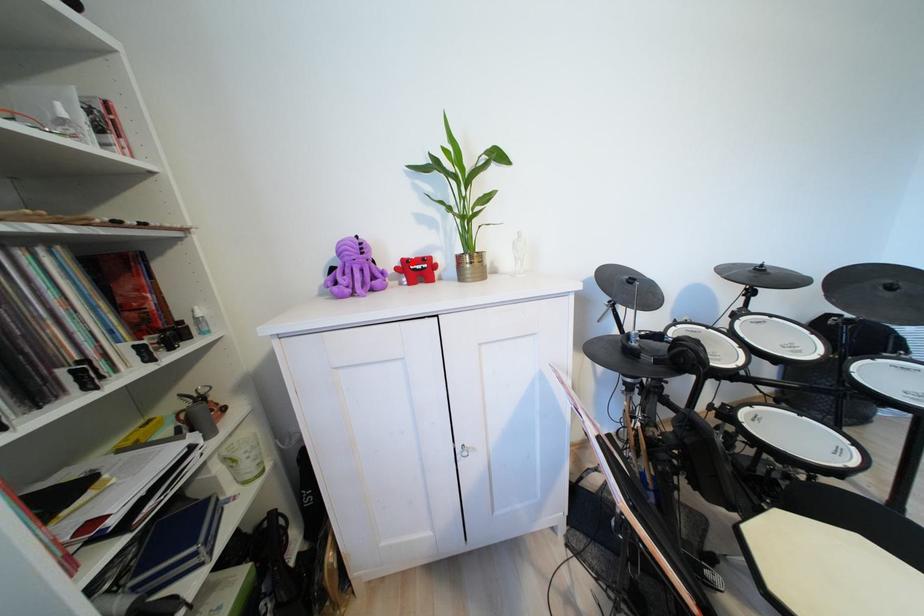
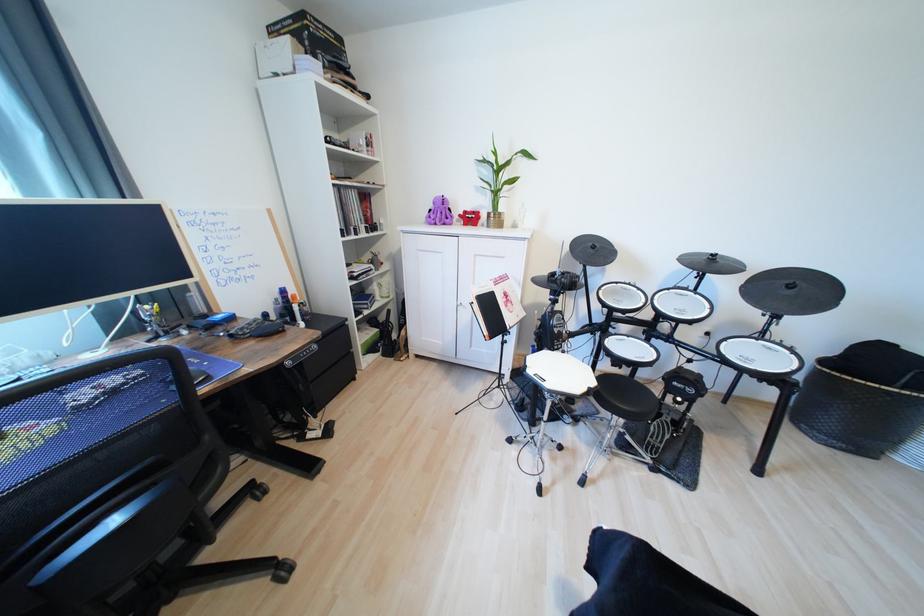
The point at the highlighted location is marked in the first image. Where is the corresponding point in the second image?

(472, 214)